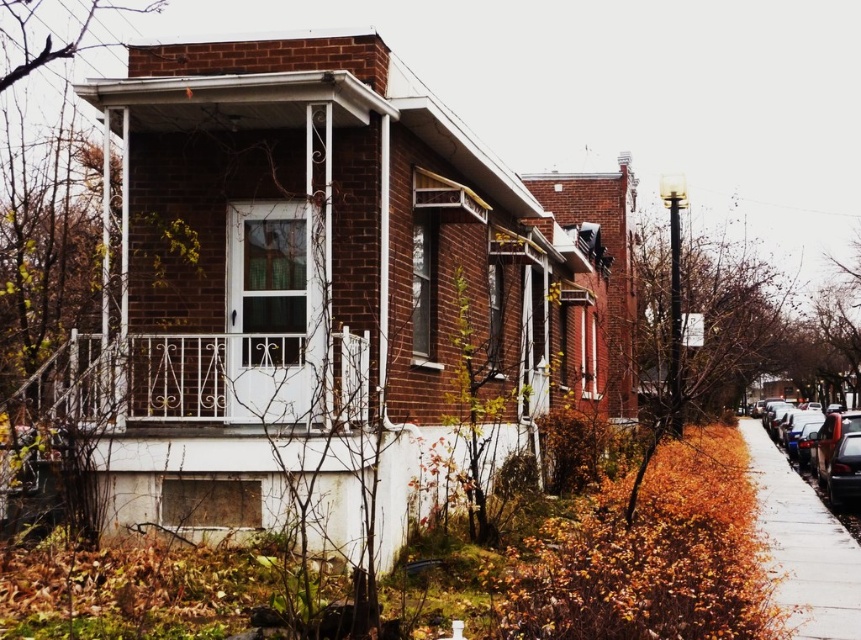
Who is shorter, white wrought iron porch at center or concrete sidewalk at lower right?

Standing shorter between the two is white wrought iron porch at center.

Can you confirm if white wrought iron porch at center is thinner than concrete sidewalk at lower right?

Yes.

I want to click on white wrought iron porch at center, so click(x=208, y=378).

Where is `white wrought iron porch at center`? The image size is (861, 640). white wrought iron porch at center is located at coordinates (208, 378).

Between concrete sidewalk at lower right and shiny black sedan at right, which one has more height?

Standing taller between the two is shiny black sedan at right.

In the scene shown: Which is more to the left, concrete sidewalk at lower right or shiny black sedan at right?

concrete sidewalk at lower right

The image size is (861, 640). I want to click on concrete sidewalk at lower right, so click(x=803, y=545).

The height and width of the screenshot is (640, 861). Find the location of `concrete sidewalk at lower right`. concrete sidewalk at lower right is located at coordinates (803, 545).

Which of these two, white wrought iron porch at center or shiny black sedan at right, stands taller?

shiny black sedan at right

Which is more to the left, white wrought iron porch at center or shiny black sedan at right?

Positioned to the left is white wrought iron porch at center.

Describe the element at coordinates (208, 378) in the screenshot. Image resolution: width=861 pixels, height=640 pixels. I see `white wrought iron porch at center` at that location.

I want to click on white wrought iron porch at center, so click(x=208, y=378).